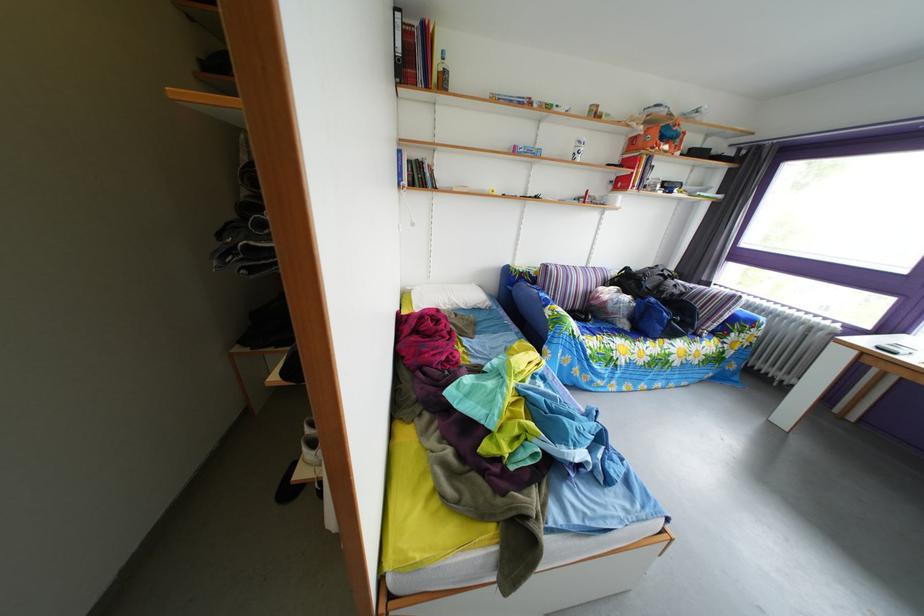
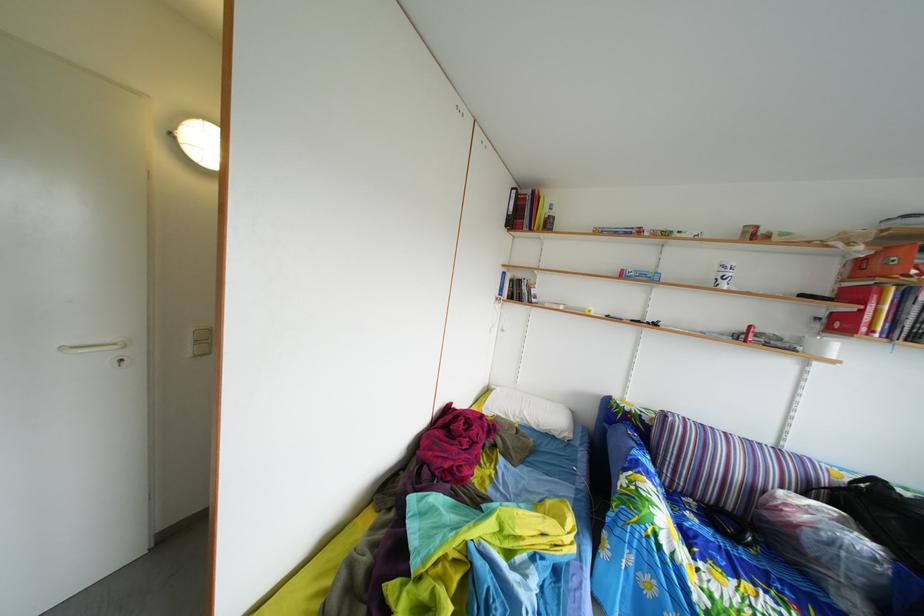
The point at (638, 289) is marked in the first image. Where is the corresponding point in the second image?

(886, 515)